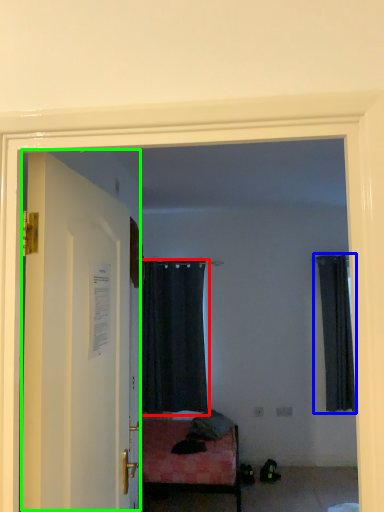
Question: Based on their relative distances, which object is farther from curtain (highlighted by a red box)? Choose from curtain (highlighted by a blue box) and door (highlighted by a green box).

Choices:
 (A) curtain
 (B) door

Answer: (B)